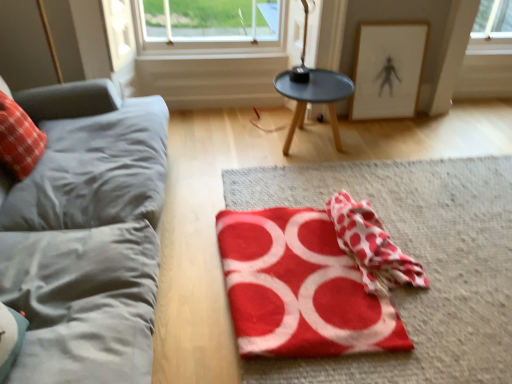
Where is `empty space that is to the right of red polka dot fabric at center`? Image resolution: width=512 pixels, height=384 pixels. empty space that is to the right of red polka dot fabric at center is located at coordinates (451, 248).